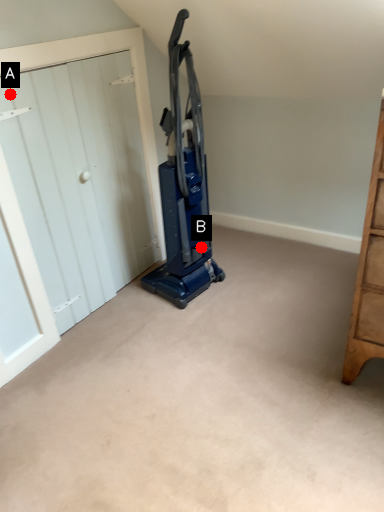
Question: Two points are circled on the image, labeled by A and B beside each circle. Among these points, which one is farthest from the camera?

Choices:
 (A) A is further
 (B) B is further

Answer: (B)